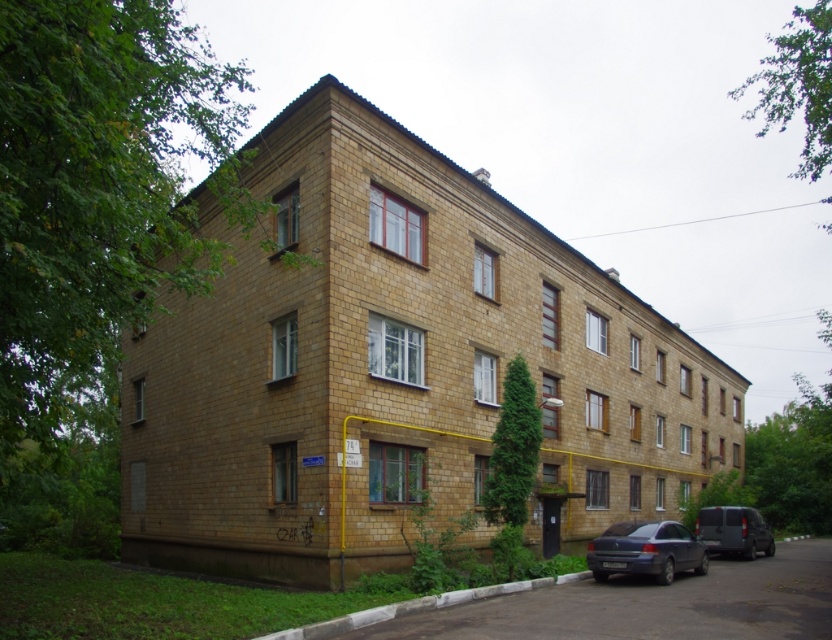
Between metallic blue sedan at lower right and dark gray matte van at lower right, which one has more height?

dark gray matte van at lower right

Is metallic blue sedan at lower right positioned before dark gray matte van at lower right?

Yes, metallic blue sedan at lower right is in front of dark gray matte van at lower right.

Between point (603, 557) and point (719, 536), which one is positioned behind?

The point (719, 536) is behind.

This screenshot has width=832, height=640. I want to click on metallic blue sedan at lower right, so click(646, 550).